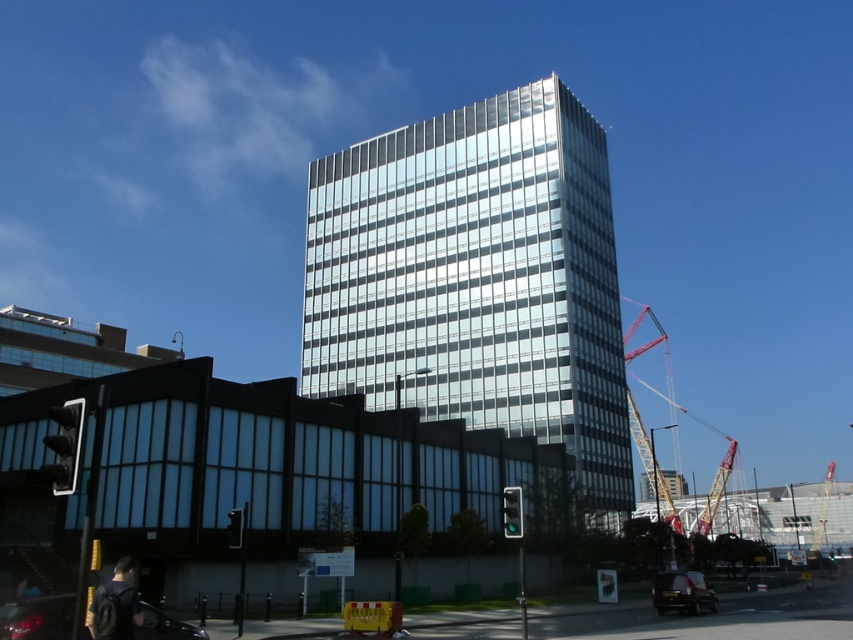
You are a city planner assessing the urban layout. You need to determine if the yellow metallic crane at right can fit into a space reserved for the shiny black car at lower right. Based on their widths, can the crane fit?

The yellow metallic crane at right is wider than the shiny black car at lower right, so it cannot fit into the space reserved for the shiny black car at lower right.

You are standing at the point with coordinates (477, 280) in the image. What object is located at that point?

The point at coordinates (477, 280) corresponds to the glassy reflective building at center.